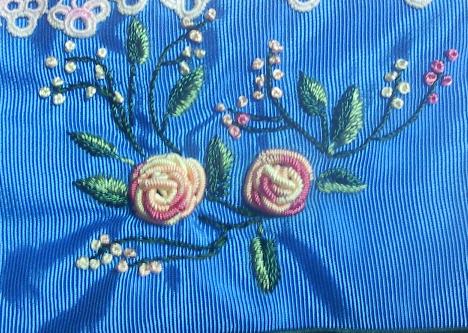
Find the location of `lace`. lace is located at coordinates (78, 15).